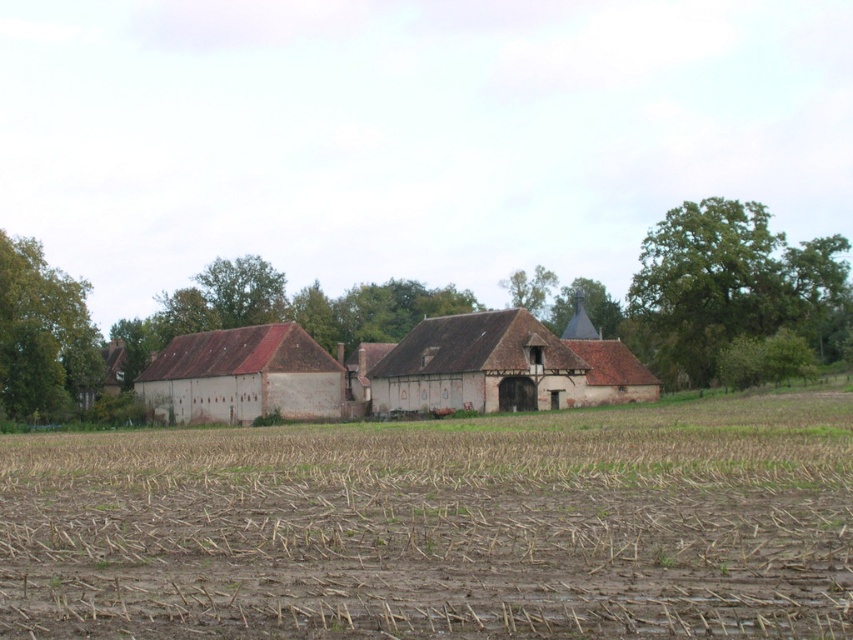
You are a farmer checking the field. You notice the brown soil at center and the green leafy tree at upper center. Which object is located higher in the image?

The green leafy tree at upper center is located higher in the image than the brown soil at center.

In the scene shown: You are standing at the point marked by the coordinates point (440, 525) in the image. What is the type of material you are currently standing on?

The point (440, 525) corresponds to brown soil at center, so you are standing on brown soil.